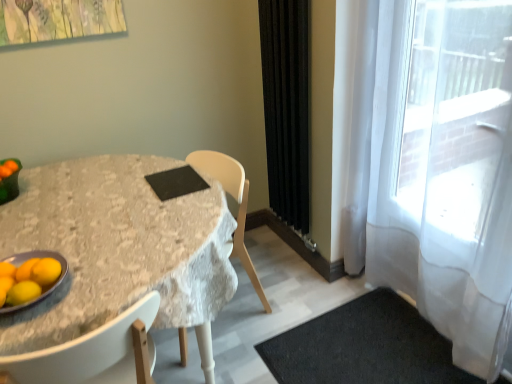
Question: Considering the relative sizes of black fabric curtain at right, arranged as the second curtain when viewed from the right, and yellow matte/orange at lower left in the image provided, is black fabric curtain at right, arranged as the second curtain when viewed from the right, taller than yellow matte/orange at lower left?

Choices:
 (A) yes
 (B) no

Answer: (A)

Question: Does black fabric curtain at right, arranged as the second curtain when viewed from the right, appear on the left side of yellow matte/orange at lower left?

Choices:
 (A) yes
 (B) no

Answer: (B)

Question: Is black fabric curtain at right, arranged as the second curtain when viewed from the right, not inside yellow matte/orange at lower left?

Choices:
 (A) no
 (B) yes

Answer: (B)

Question: Is black fabric curtain at right, which is the 1th curtain in left-to-right order, to the right of yellow matte/orange at lower left from the viewer's perspective?

Choices:
 (A) no
 (B) yes

Answer: (B)

Question: Is yellow matte/orange at lower left located within black fabric curtain at right, arranged as the second curtain when viewed from the right?

Choices:
 (A) no
 (B) yes

Answer: (A)

Question: Considering the relative sizes of black fabric curtain at right, arranged as the second curtain when viewed from the right, and yellow matte/orange at lower left in the image provided, is black fabric curtain at right, arranged as the second curtain when viewed from the right, thinner than yellow matte/orange at lower left?

Choices:
 (A) no
 (B) yes

Answer: (A)

Question: Is linen-covered table at center facing away from metallic gray platter at lower left?

Choices:
 (A) yes
 (B) no

Answer: (B)

Question: From the image's perspective, is linen-covered table at center on metallic gray platter at lower left?

Choices:
 (A) yes
 (B) no

Answer: (B)

Question: Does linen-covered table at center have a greater width compared to metallic gray platter at lower left?

Choices:
 (A) no
 (B) yes

Answer: (B)

Question: Considering the relative sizes of linen-covered table at center and metallic gray platter at lower left in the image provided, is linen-covered table at center shorter than metallic gray platter at lower left?

Choices:
 (A) no
 (B) yes

Answer: (A)

Question: Is linen-covered table at center facing towards metallic gray platter at lower left?

Choices:
 (A) yes
 (B) no

Answer: (B)

Question: Considering the relative sizes of linen-covered table at center and metallic gray platter at lower left in the image provided, is linen-covered table at center smaller than metallic gray platter at lower left?

Choices:
 (A) no
 (B) yes

Answer: (A)

Question: From the image's perspective, is linen-covered table at center beneath orange matte tangerine at lower left?

Choices:
 (A) yes
 (B) no

Answer: (A)